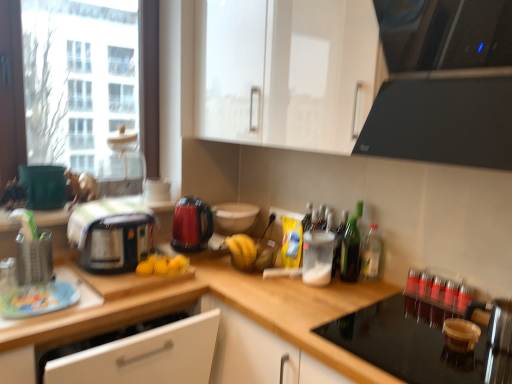
What are the coordinates of `empty space that is ontop of black glass stovetop at lower right, positioned as the fifth appliance in left-to-right order (from a real-world perspective)` in the screenshot? It's located at pos(414,337).